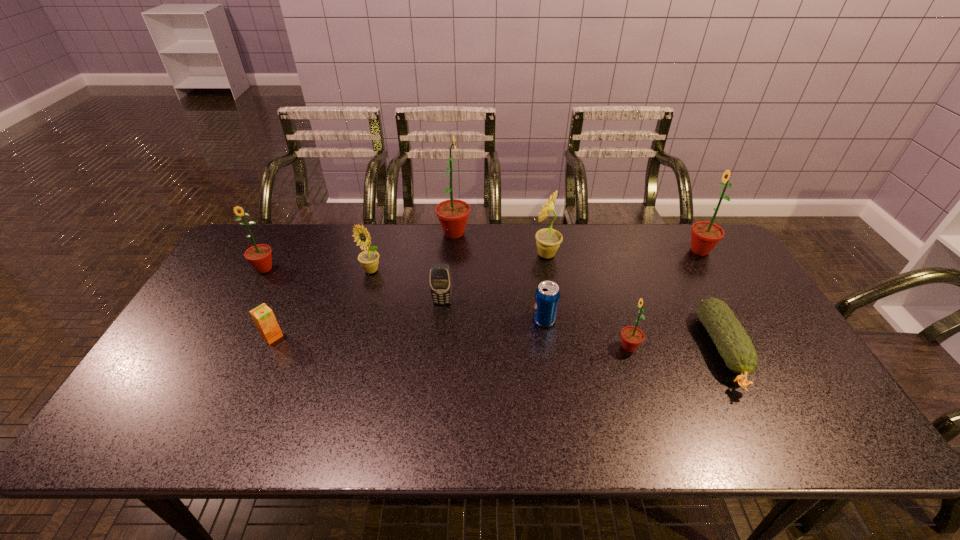
Identify the location of the third sunflower from left to right. The height and width of the screenshot is (540, 960). (453, 214).

I want to click on the biggest green sunflower, so click(453, 214).

The image size is (960, 540). In order to click on the third smallest green sunflower in this screenshot , I will do `click(705, 235)`.

The image size is (960, 540). I want to click on the second tallest sunflower, so click(705, 235).

Identify the location of the right yellow sunflower. (548, 240).

Where is `the fourth sunflower from left to right`? the fourth sunflower from left to right is located at coordinates (548, 240).

Find the location of a particular element. This screenshot has width=960, height=540. the leftmost sunflower is located at coordinates (259, 256).

Identify the location of the third biggest green sunflower. Image resolution: width=960 pixels, height=540 pixels. (259, 256).

Locate an element on the screen. This screenshot has width=960, height=540. the nearest green sunflower is located at coordinates (632, 337).

Find the location of a particular element. Image resolution: width=960 pixels, height=540 pixels. the smallest green sunflower is located at coordinates click(x=632, y=337).